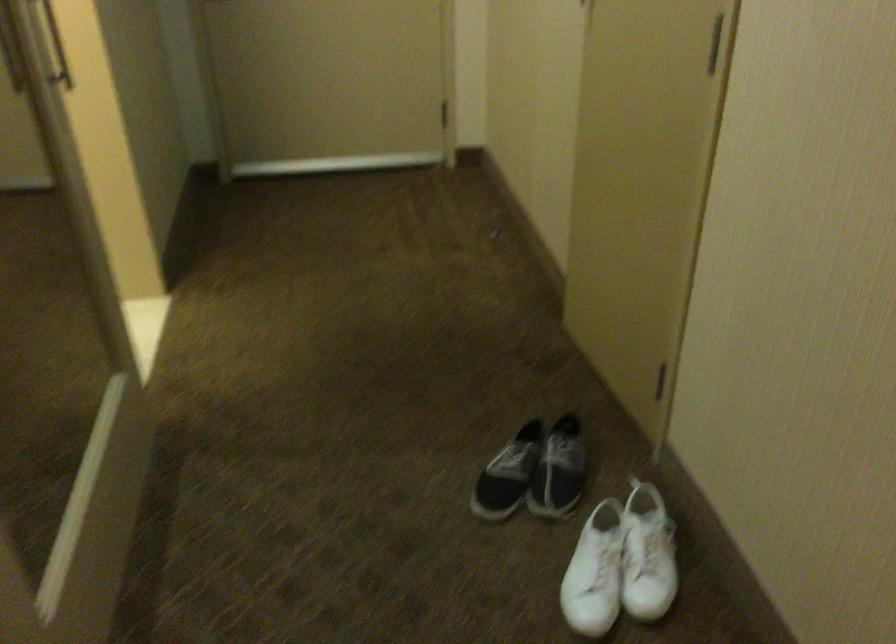
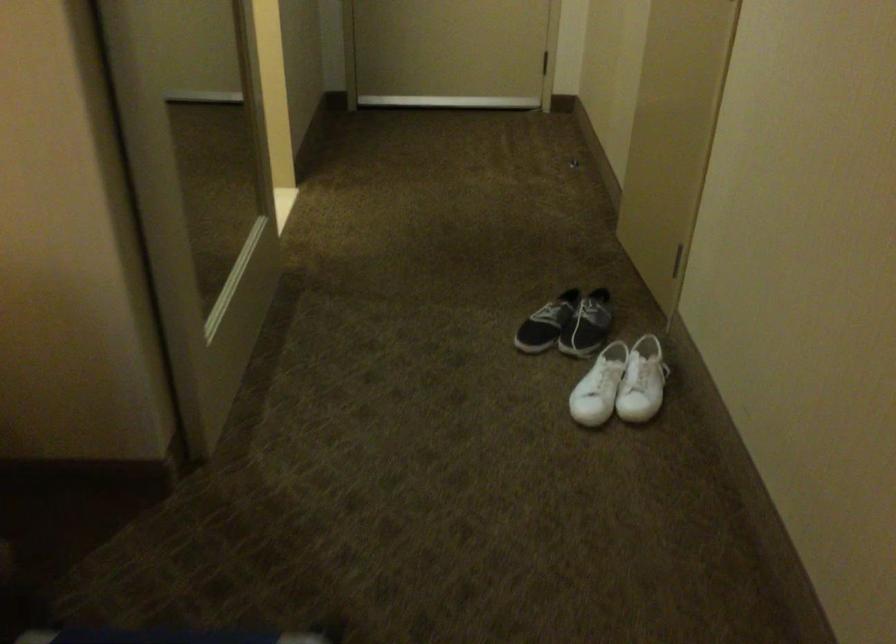
The point at (595, 574) is marked in the first image. Where is the corresponding point in the second image?

(599, 386)